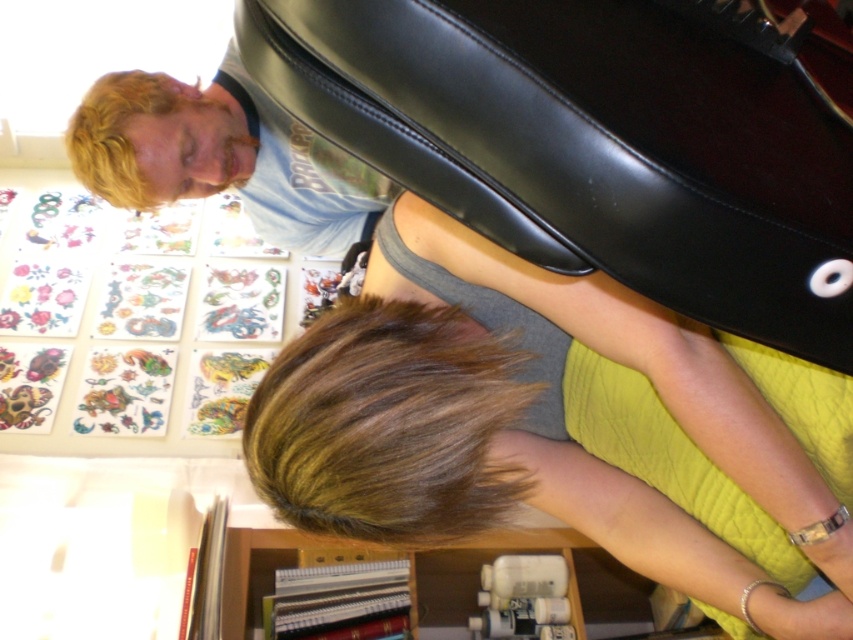
Does point (258, 388) come farther from viewer compared to point (459, 516)?

Yes, it is behind point (459, 516).

Is matte gray tank top at center smaller than brown shiny hair at lower center?

No.

Who is more distant from viewer, (686, 330) or (502, 476)?

Point (502, 476)

The image size is (853, 640). I want to click on matte gray tank top at center, so click(523, 420).